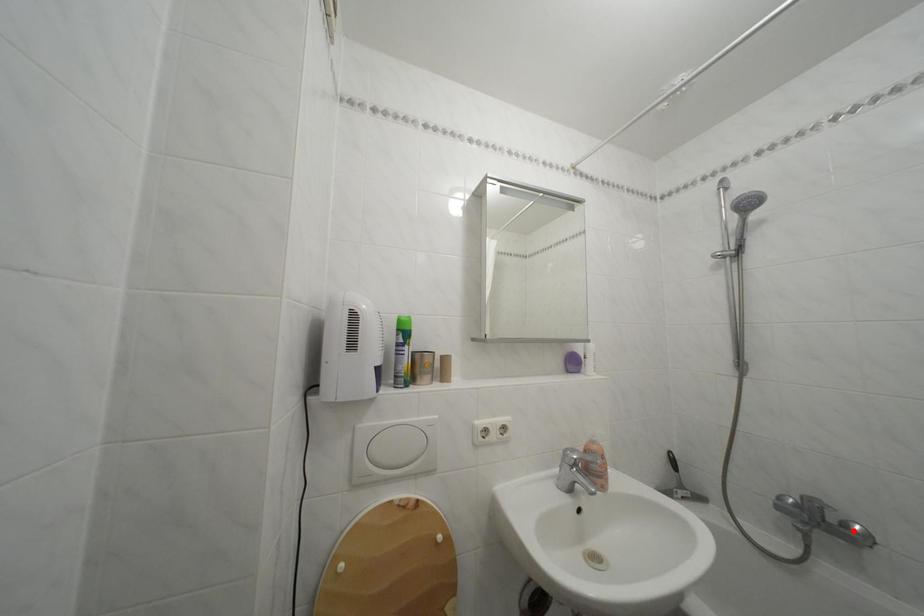
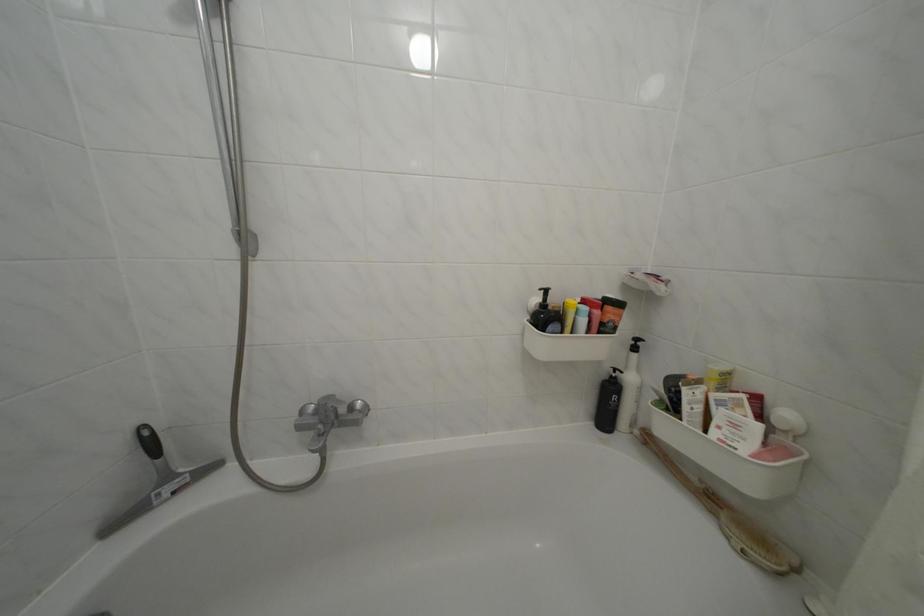
In the second image, find the point that corresponds to the highlighted location in the first image.

(359, 414)